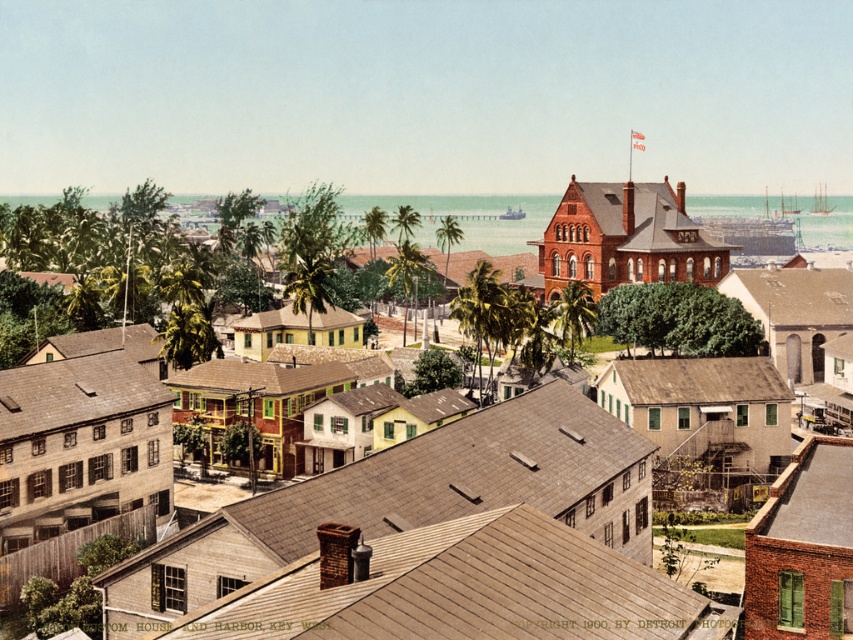
Question: Is matte brown building at center closer to the viewer compared to brown shingles at center?

Choices:
 (A) yes
 (B) no

Answer: (B)

Question: Which object appears closest to the camera in this image?

Choices:
 (A) brown shingles at center
 (B) matte brown building at center

Answer: (A)

Question: Does matte brown building at center have a greater width compared to brown shingles at center?

Choices:
 (A) yes
 (B) no

Answer: (A)

Question: Which of the following is the farthest from the observer?

Choices:
 (A) matte brown building at center
 (B) brown shingles at center

Answer: (A)

Question: Is matte brown building at center bigger than brown shingles at center?

Choices:
 (A) no
 (B) yes

Answer: (B)